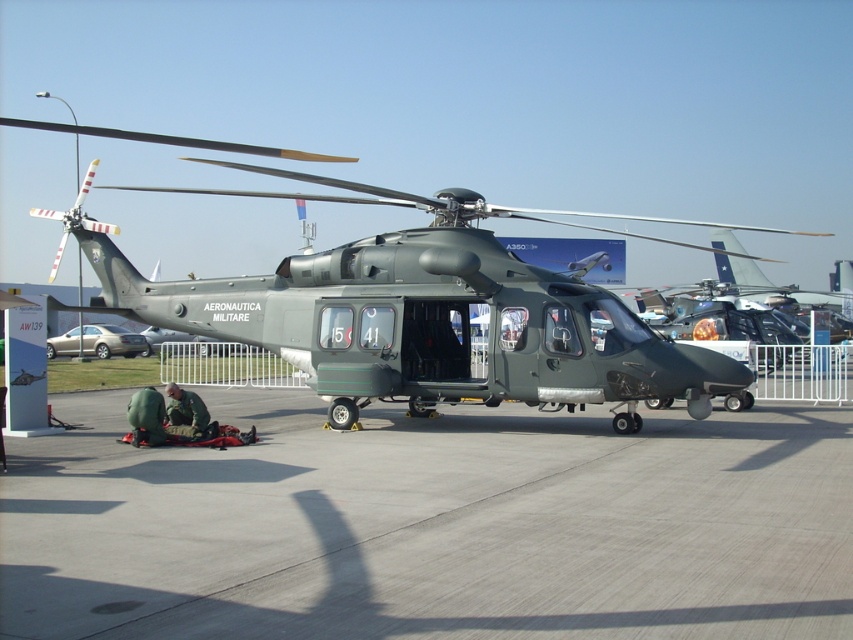
Can you confirm if gray concrete tarmac at center is positioned above green fabric uniform at lower left?

Actually, gray concrete tarmac at center is below green fabric uniform at lower left.

Who is taller, gray concrete tarmac at center or green fabric uniform at lower left?

With more height is green fabric uniform at lower left.

Who is more distant from viewer, (167, 467) or (173, 381)?

The point (173, 381) is behind.

You are a GUI agent. You are given a task and a screenshot of the screen. Output one action in this format:
    pyautogui.click(x=<x>, y=<y>)
    Task: Click on the gray concrete tarmac at center
    The width and height of the screenshot is (853, 640).
    Given the screenshot: What is the action you would take?
    pyautogui.click(x=431, y=525)

Between matte green helicopter at center and green fabric uniform at lower left, which one appears on the right side from the viewer's perspective?

From the viewer's perspective, matte green helicopter at center appears more on the right side.

Between point (236, 323) and point (172, 401), which one is positioned behind?

Positioned behind is point (236, 323).

Find the location of a particular element. matte green helicopter at center is located at coordinates (425, 310).

Is gray concrete tarmac at center positioned at the back of matte green helicopter at center?

No.

Does point (555, 550) lie in front of point (583, 342)?

Yes, it is in front of point (583, 342).

The image size is (853, 640). In order to click on gray concrete tarmac at center in this screenshot , I will do `click(431, 525)`.